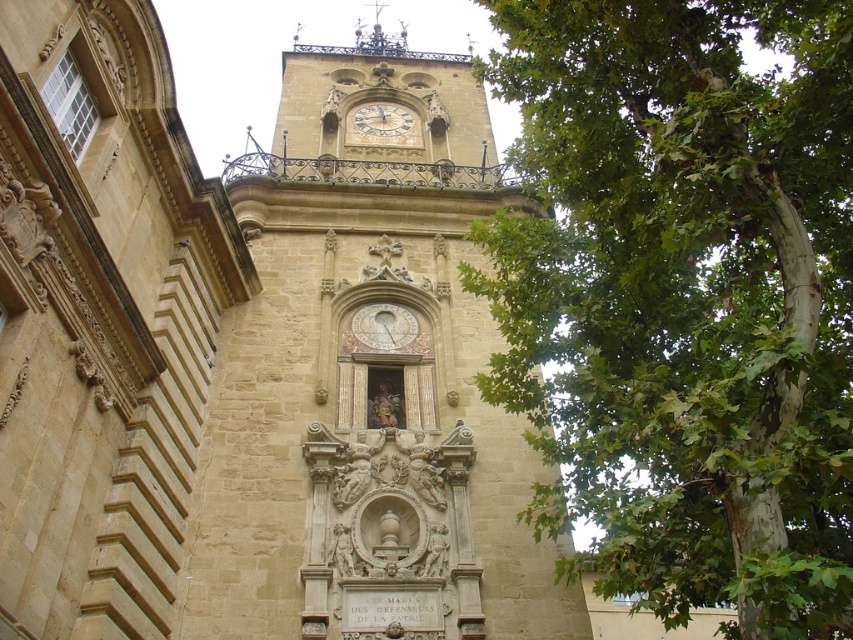
Which of these two, green leafy tree at upper right or gold-toned metal clock at upper center, stands taller?

green leafy tree at upper right

This screenshot has height=640, width=853. Describe the element at coordinates (683, 298) in the screenshot. I see `green leafy tree at upper right` at that location.

Which is in front, point (662, 541) or point (357, 122)?

Positioned in front is point (662, 541).

What are the coordinates of `green leafy tree at upper right` in the screenshot? It's located at (683, 298).

Between stone clock tower at center and gold-toned metal clock at upper center, which one appears on the right side from the viewer's perspective?

Positioned to the right is gold-toned metal clock at upper center.

The height and width of the screenshot is (640, 853). What do you see at coordinates (248, 356) in the screenshot?
I see `stone clock tower at center` at bounding box center [248, 356].

Find the location of a particular element. stone clock tower at center is located at coordinates (248, 356).

Can you confirm if green leafy tree at upper right is thinner than gold metallic clock at center?

No.

Does green leafy tree at upper right have a larger size compared to gold metallic clock at center?

Yes.

In order to click on green leafy tree at upper right in this screenshot , I will do `click(683, 298)`.